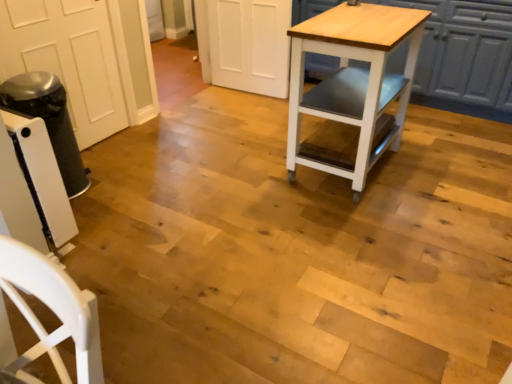
Question: Relative to white wood cabinet at upper right, is light wood/matte table at center in front or behind?

Choices:
 (A) behind
 (B) front

Answer: (B)

Question: From the image's perspective, is light wood/matte table at center above or below white wood cabinet at upper right?

Choices:
 (A) below
 (B) above

Answer: (A)

Question: Based on their positions, is light wood/matte table at center located to the left or right of white wood cabinet at upper right?

Choices:
 (A) left
 (B) right

Answer: (A)

Question: In terms of height, does white wood cabinet at upper right look taller or shorter compared to light wood/matte table at center?

Choices:
 (A) short
 (B) tall

Answer: (A)

Question: Based on their sizes in the image, would you say white wood cabinet at upper right is bigger or smaller than light wood/matte table at center?

Choices:
 (A) big
 (B) small

Answer: (A)

Question: In the image, is white wood cabinet at upper right positioned in front of or behind light wood/matte table at center?

Choices:
 (A) front
 (B) behind

Answer: (B)

Question: Considering the positions of white wood cabinet at upper right and light wood/matte table at center in the image, is white wood cabinet at upper right wider or thinner than light wood/matte table at center?

Choices:
 (A) thin
 (B) wide

Answer: (B)